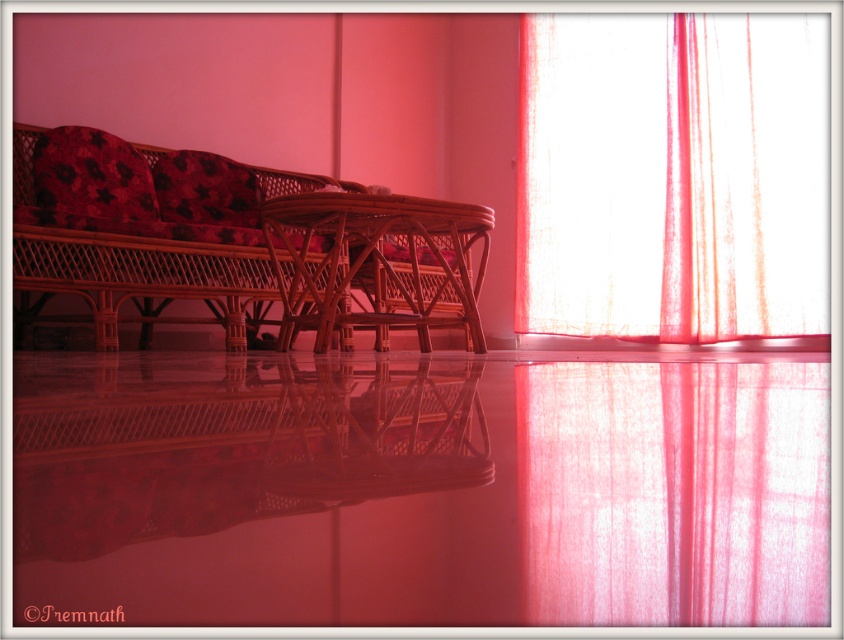
Question: Does sheer white curtain at right appear on the left side of floral fabric pillow at upper left?

Choices:
 (A) no
 (B) yes

Answer: (A)

Question: Does sheer white curtain at right have a smaller size compared to woven wood couch at left?

Choices:
 (A) yes
 (B) no

Answer: (A)

Question: Can you confirm if woven wood armchair at center is wider than floral fabric pillow at left?

Choices:
 (A) yes
 (B) no

Answer: (A)

Question: Which object is closer to the camera taking this photo?

Choices:
 (A) floral fabric pillow at left
 (B) sheer white curtain at right
 (C) woven wood armchair at center

Answer: (B)

Question: Which of the following is the closest to the observer?

Choices:
 (A) (100, 189)
 (B) (718, 26)
 (C) (436, 264)
 (D) (158, 276)

Answer: (D)

Question: Which object is the closest to the floral fabric pillow at upper left?

Choices:
 (A) floral fabric pillow at left
 (B) woven wood couch at left
 (C) translucent pink fabric at upper right
 (D) woven wood armchair at center

Answer: (B)